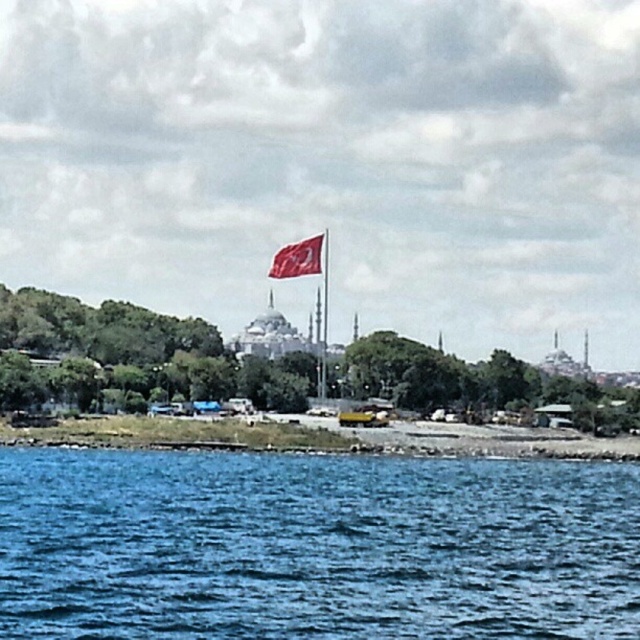
Question: Is blue liquid water at lower center positioned in front of red fabric flag at center?

Choices:
 (A) no
 (B) yes

Answer: (B)

Question: Considering the relative positions of blue liquid water at lower center and red fabric flag at center in the image provided, where is blue liquid water at lower center located with respect to red fabric flag at center?

Choices:
 (A) above
 (B) below

Answer: (B)

Question: Considering the relative positions of blue liquid water at lower center and red fabric flag at center in the image provided, where is blue liquid water at lower center located with respect to red fabric flag at center?

Choices:
 (A) left
 (B) right

Answer: (B)

Question: Which object is closer to the camera taking this photo?

Choices:
 (A) red fabric flag at center
 (B) blue liquid water at lower center

Answer: (B)

Question: Which point is closer to the camera taking this photo?

Choices:
 (A) (468, 480)
 (B) (276, 272)

Answer: (A)